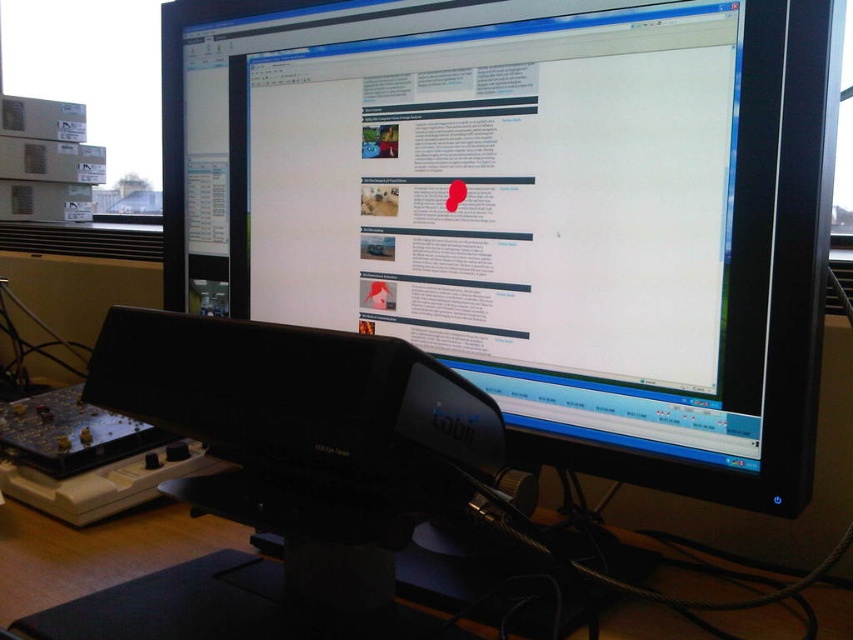
Is matte black monitor at center shorter than black plastic tobii eye tracker at lower center?

In fact, matte black monitor at center may be taller than black plastic tobii eye tracker at lower center.

Locate an element on the screen. The height and width of the screenshot is (640, 853). matte black monitor at center is located at coordinates (544, 227).

Identify the location of matte black monitor at center. The height and width of the screenshot is (640, 853). (544, 227).